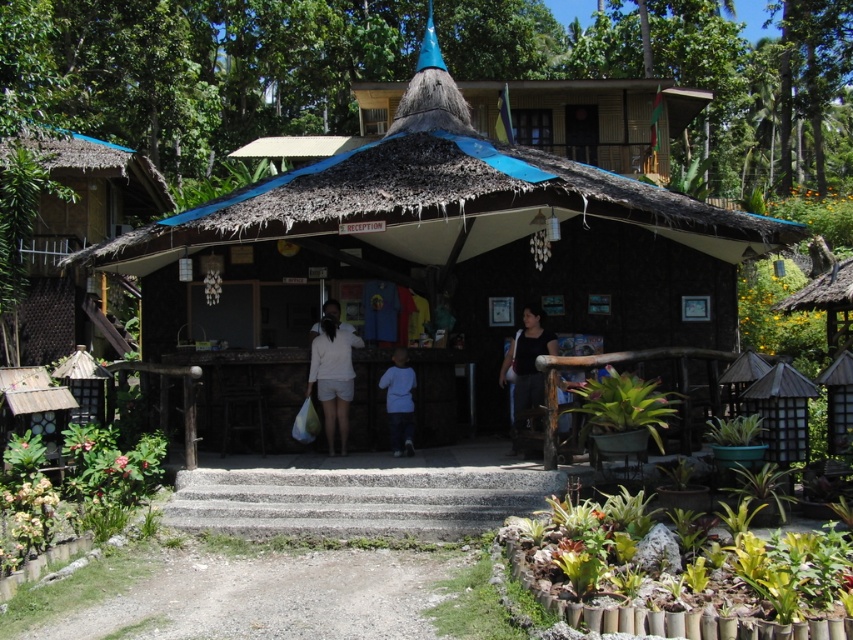
You are a visitor at this resort and want to find the reception desk. You see the brown thatch hut at center and the light blue fabric at center. Which one is closer to you?

The brown thatch hut at center is closer to you since it is in front of the light blue fabric at center.

You are standing at the entrance of the rustic tropical building and need to reach the second floor. Where are the gray concrete stairs at center located?

The gray concrete stairs at center are located at point (357, 500).